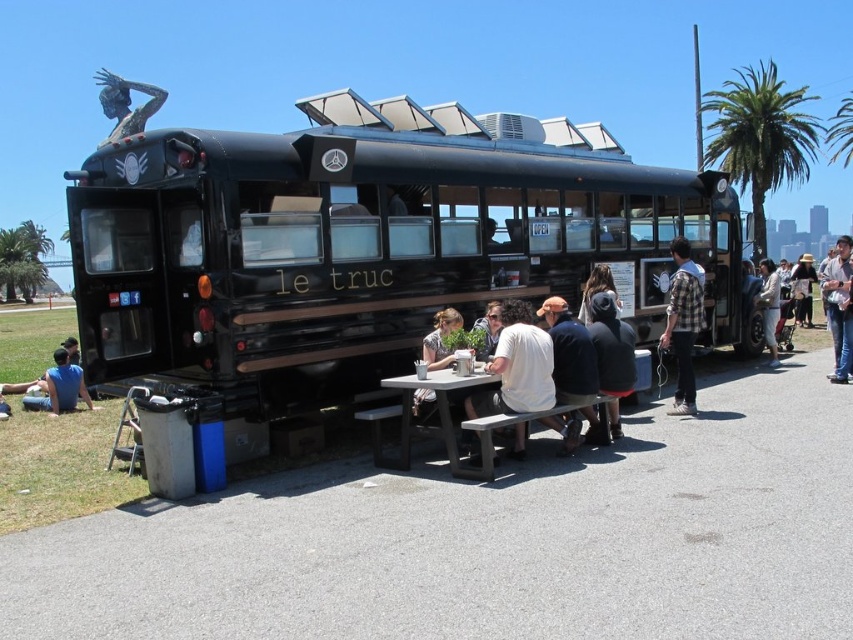
You are a customer at the food truck and want to sit down at the picnic table. You see a black hoodie at center and a blue cotton shirt at lower left. Which clothing item is closer to you?

The black hoodie at center is closer to you because it is in front of the blue cotton shirt at lower left.

You are organizing a community event and need to seat guests around the picnic table. Given the plaid shirt at right and the blue cotton shirt at lower left, which shirt is taking up more space on the table?

The blue cotton shirt at lower left occupies more space than the plaid shirt at right.